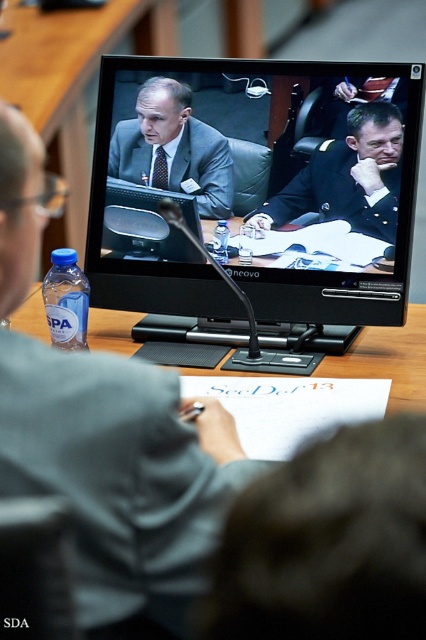
You are a guest speaker at a conference and need to locate your laptop and suit. Given the scene described, where is the matte black laptop at left in relation to the dark gray suit at lower right?

The matte black laptop at left is positioned to the left of the dark gray suit at lower right.

You are a drone operator controlling a drone that needs to hover exactly at point (x=316, y=536) in the scene. The drone has a maximum hover distance of 22 inches from the camera. Can the drone safely hover at that point without exceeding its maximum distance?

The distance of point (x=316, y=536) from the camera is 22.60 inches, which exceeds the drone maximum hover distance of 22 inches. Therefore, the drone cannot safely hover at that point.

You are a security guard in the room and need to check the dark gray suit at lower right. To do this, do you need to move the matte black monitor at center?

The matte black monitor at center is above the dark gray suit at lower right, so you would need to move the matte black monitor at center to access the dark gray suit at lower right.